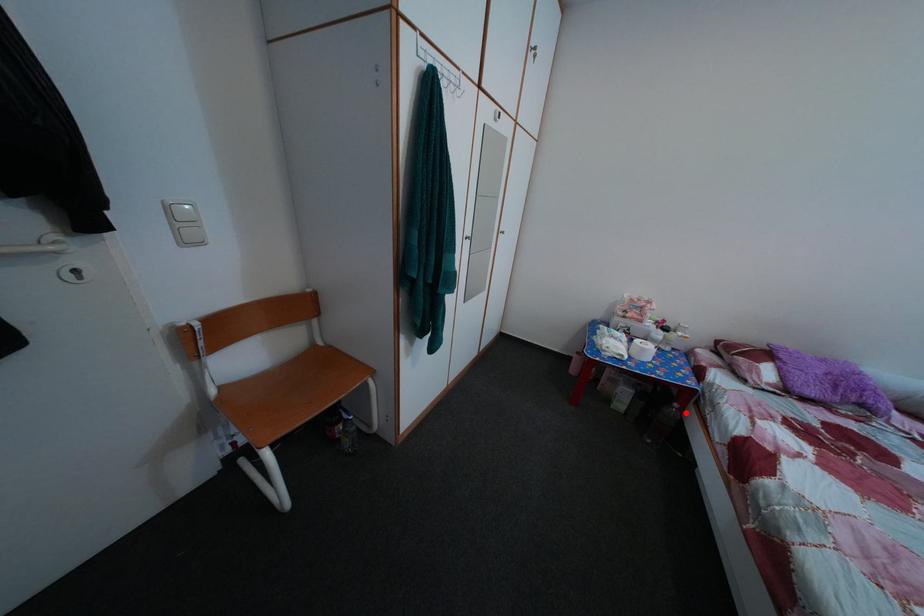
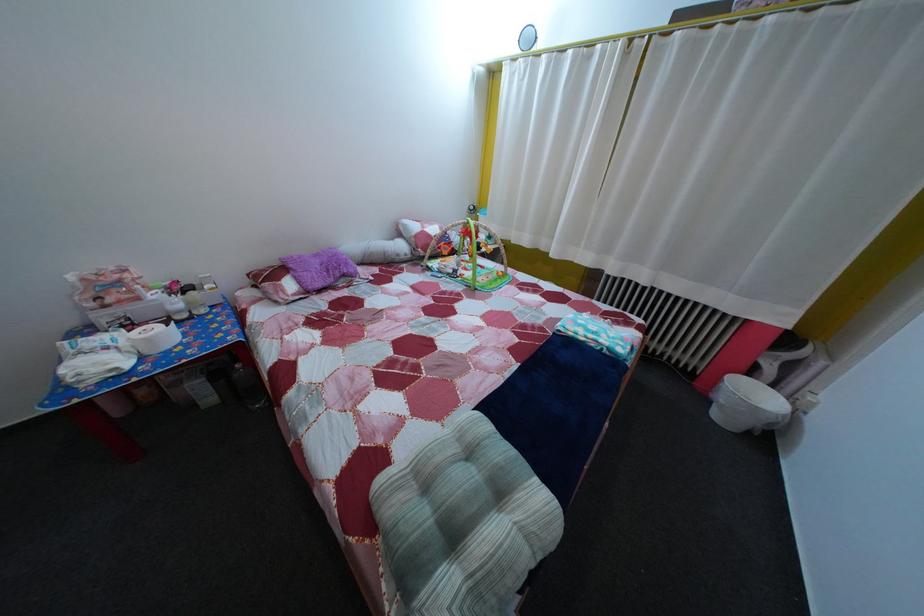
The point at the highlighted location is marked in the first image. Where is the corresponding point in the second image?

(248, 374)